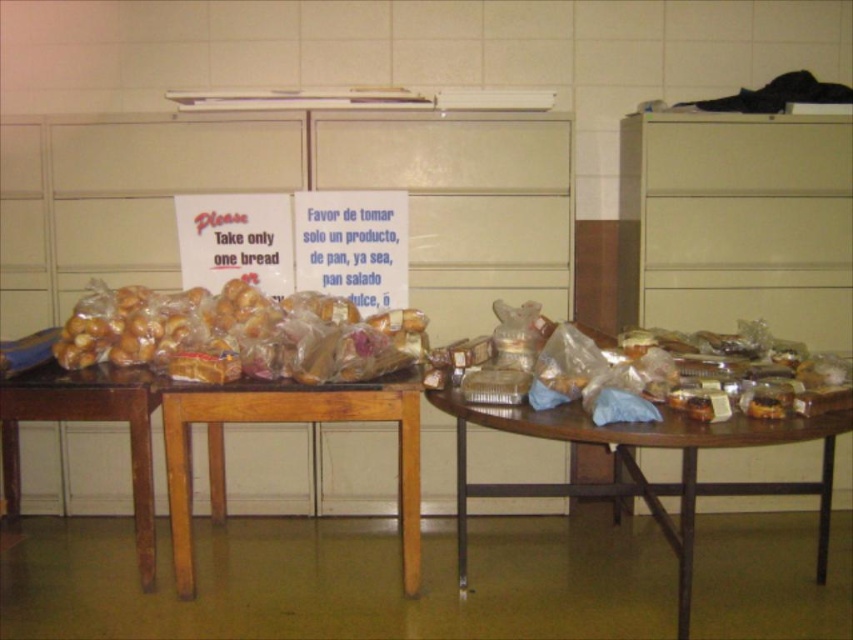
You are a volunteer at the food distribution event and need to place a new sign that is 2 feet wide between the translucent plastic baguette at center and the camera. Is there enough space to place the sign without moving the baguette?

The distance between the translucent plastic baguette at center and the camera is 8.36 feet. Since the sign is only 2 feet wide, there is sufficient space to place the sign without moving the baguette.